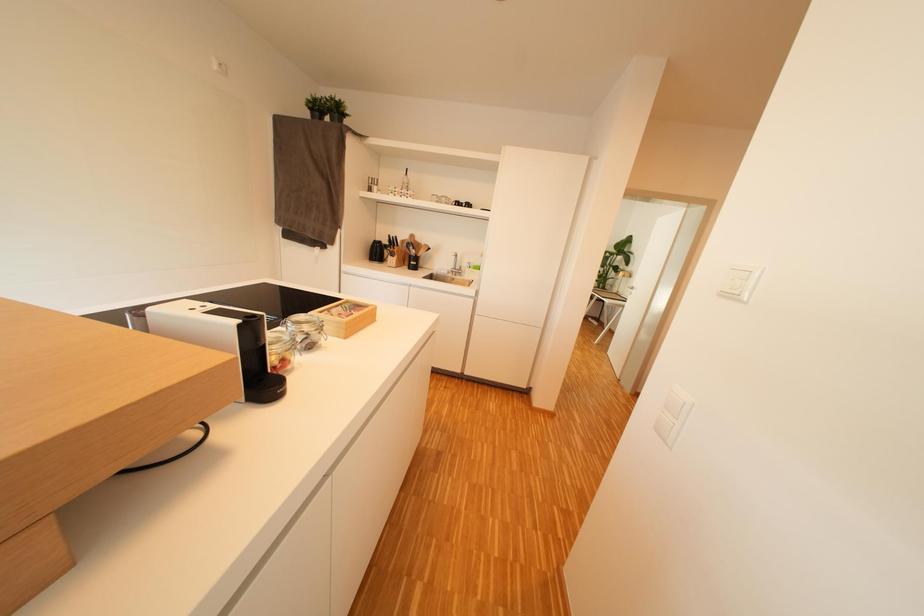
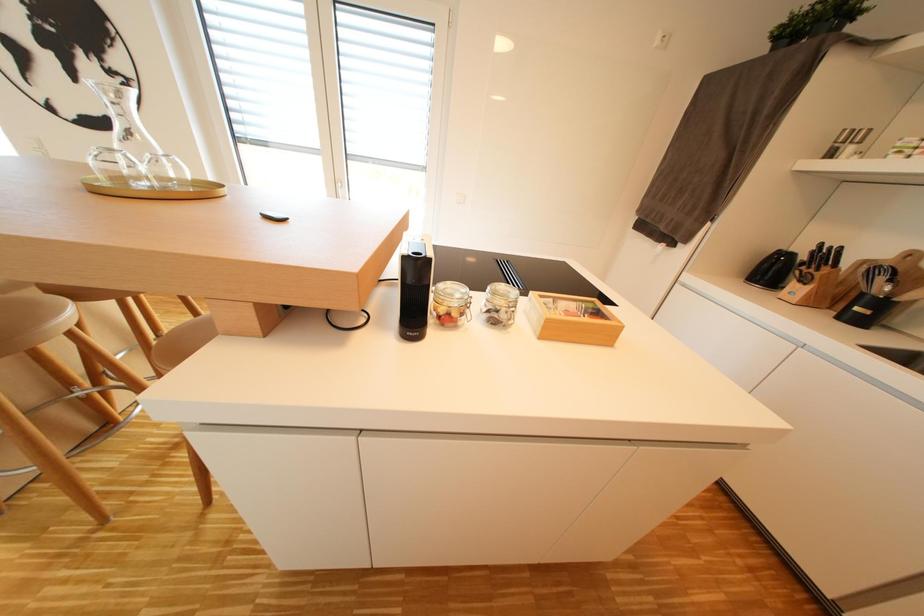
In the scene shown: First-person continuous shooting, in which direction is the camera rotating?

The camera's rotation is toward left-down.